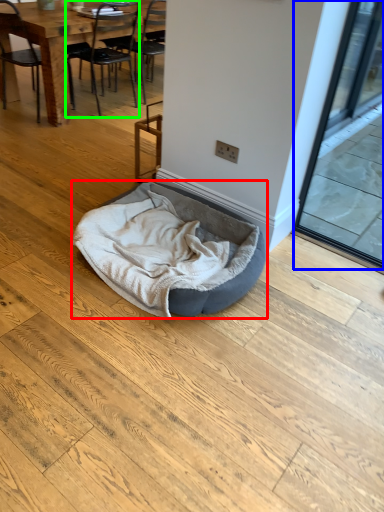
Question: Considering the real-world distances, which object is farthest from dog bed (highlighted by a red box)? screen door (highlighted by a blue box) or chair (highlighted by a green box)?

Choices:
 (A) screen door
 (B) chair

Answer: (B)